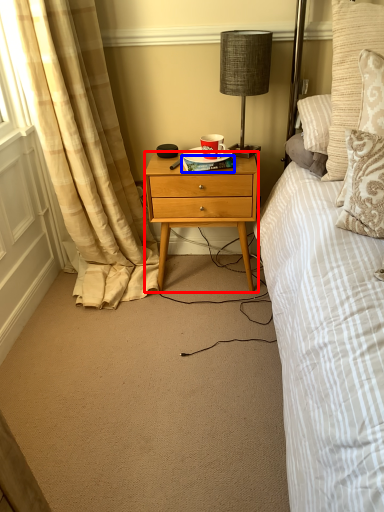
Question: Which point is further to the camera, desk (highlighted by a red box) or book (highlighted by a blue box)?

Choices:
 (A) desk
 (B) book

Answer: (B)